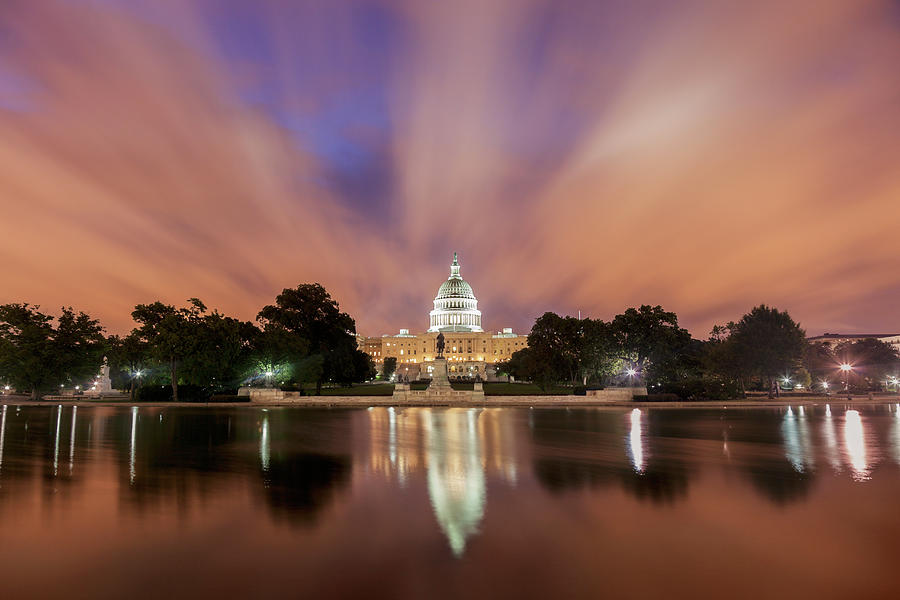
Find the location of `light`. light is located at coordinates pos(76,384).